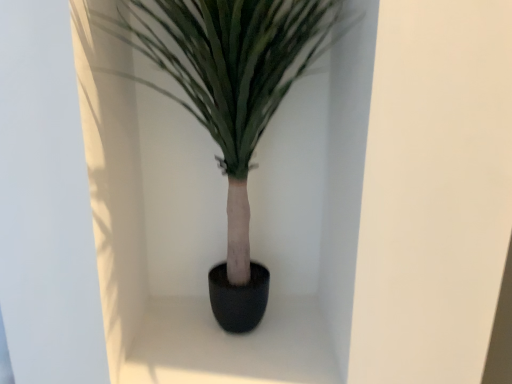
Question: Would you say black matte pot at center is to the left or to the right of green matte plant at center in the picture?

Choices:
 (A) left
 (B) right

Answer: (B)

Question: In terms of width, does black matte pot at center look wider or thinner when compared to green matte plant at center?

Choices:
 (A) thin
 (B) wide

Answer: (B)

Question: Is black matte pot at center in front of or behind green matte plant at center in the image?

Choices:
 (A) behind
 (B) front

Answer: (A)

Question: From the image's perspective, is green matte plant at center above or below black matte pot at center?

Choices:
 (A) above
 (B) below

Answer: (A)

Question: Is green matte plant at center to the left or to the right of black matte pot at center in the image?

Choices:
 (A) left
 (B) right

Answer: (A)

Question: Based on their sizes in the image, would you say green matte plant at center is bigger or smaller than black matte pot at center?

Choices:
 (A) small
 (B) big

Answer: (B)

Question: Is green matte plant at center in front of or behind black matte pot at center in the image?

Choices:
 (A) behind
 (B) front

Answer: (B)